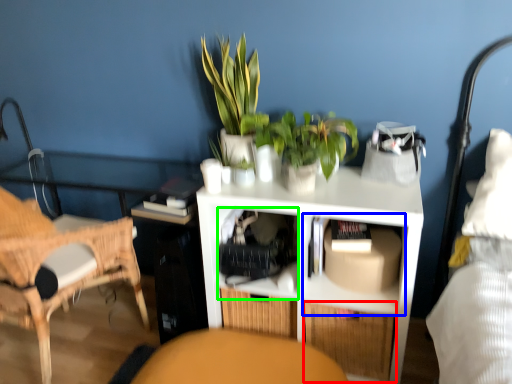
Question: Estimate the real-world distances between objects in this image. Which object is closer to drawer (highlighted by a red box), cabinet (highlighted by a blue box) or shelf (highlighted by a green box)?

Choices:
 (A) cabinet
 (B) shelf

Answer: (A)